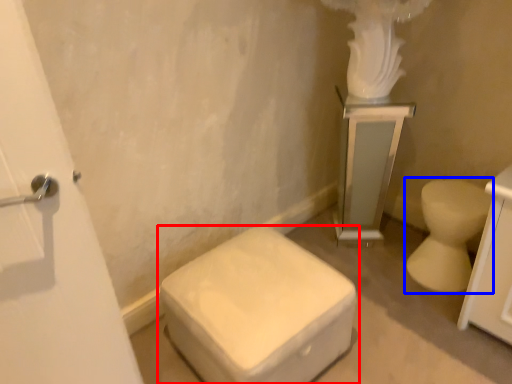
Question: Among these objects, which one is nearest to the camera, toilet (highlighted by a red box) or toilet (highlighted by a blue box)?

Choices:
 (A) toilet
 (B) toilet

Answer: (A)